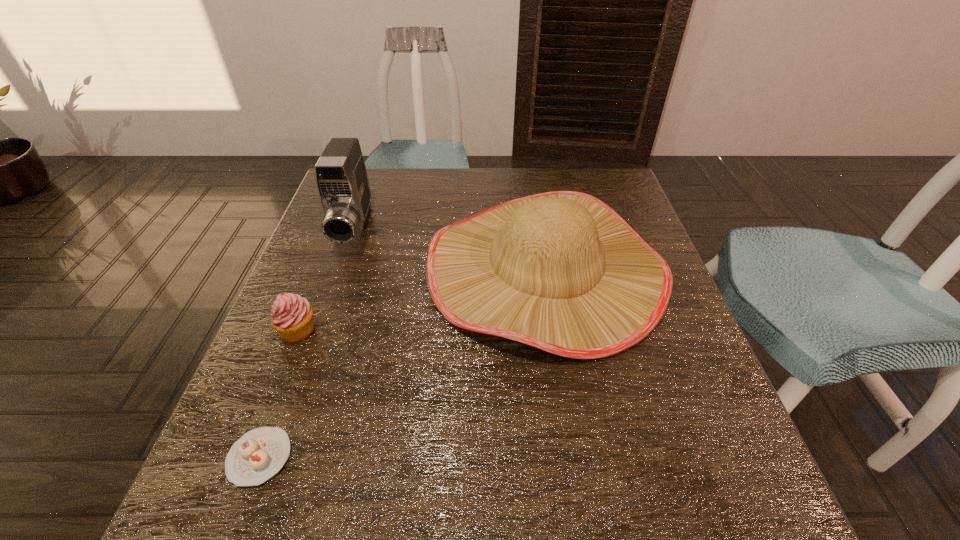
The image size is (960, 540). I want to click on camcorder situated at the far edge, so click(341, 178).

At what (x,y) coordinates should I click in order to perform the action: click on sunhat at the far edge. Please return your answer as a coordinate pair (x, y). The image size is (960, 540). Looking at the image, I should click on (561, 271).

This screenshot has height=540, width=960. What are the coordinates of `object that is at the near edge` in the screenshot? It's located at (259, 454).

At what (x,y) coordinates should I click in order to perform the action: click on camcorder that is at the left edge. Please return your answer as a coordinate pair (x, y). Looking at the image, I should click on (341, 178).

Locate an element on the screen. object present at the right edge is located at coordinates (561, 271).

Image resolution: width=960 pixels, height=540 pixels. I want to click on object at the far left corner, so click(x=341, y=178).

The height and width of the screenshot is (540, 960). Identify the location of object located in the near left corner section of the desktop. (259, 454).

Image resolution: width=960 pixels, height=540 pixels. I want to click on object that is positioned at the far right corner, so click(x=561, y=271).

Where is `vacant space at the far edge of the desktop`? Image resolution: width=960 pixels, height=540 pixels. vacant space at the far edge of the desktop is located at coordinates (402, 173).

What are the coordinates of `free space at the near edge` in the screenshot? It's located at (586, 498).